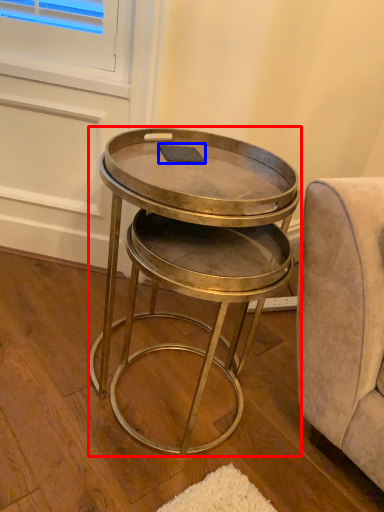
Question: Among these objects, which one is farthest to the camera, table (highlighted by a red box) or pad (highlighted by a blue box)?

Choices:
 (A) table
 (B) pad

Answer: (B)